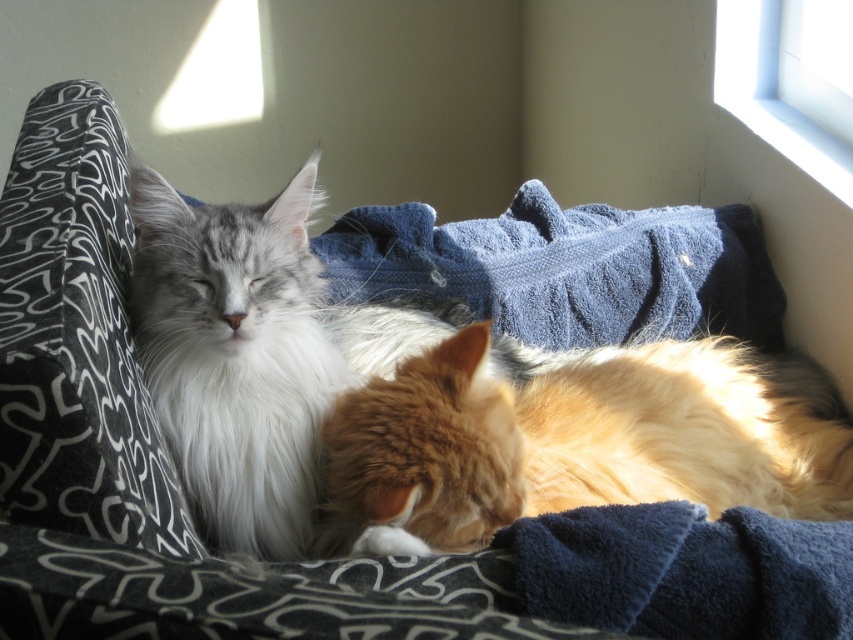
Who is positioned more to the left, silvery-white fluffy cat at left or transparent glass window at upper right?

From the viewer's perspective, silvery-white fluffy cat at left appears more on the left side.

Does point (216, 228) come farther from viewer compared to point (807, 148)?

No, (216, 228) is in front of (807, 148).

The image size is (853, 640). Identify the location of silvery-white fluffy cat at left. (236, 356).

Is point (508, 388) farther from viewer compared to point (815, 168)?

No, it is not.

Is golden fur cat at center thinner than transparent glass window at upper right?

No, golden fur cat at center is not thinner than transparent glass window at upper right.

Where is `golden fur cat at center`? The image size is (853, 640). golden fur cat at center is located at coordinates (579, 440).

Can you confirm if golden fur cat at center is smaller than silvery-white fluffy cat at left?

Incorrect, golden fur cat at center is not smaller in size than silvery-white fluffy cat at left.

Is golden fur cat at center wider than silvery-white fluffy cat at left?

Yes.

This screenshot has width=853, height=640. Find the location of `golden fur cat at center`. golden fur cat at center is located at coordinates (579, 440).

Find the location of a particular element. The image size is (853, 640). golden fur cat at center is located at coordinates (579, 440).